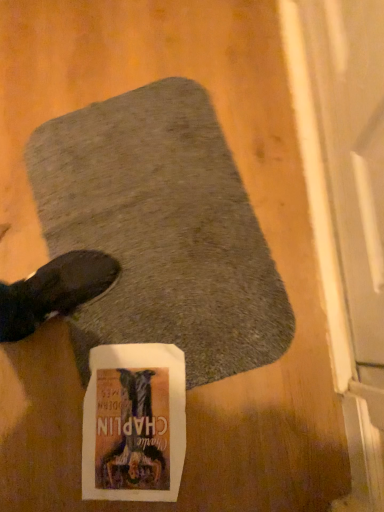
Question: Is white paper flyer at center bigger or smaller than gray soft rug at center?

Choices:
 (A) big
 (B) small

Answer: (B)

Question: From the image's perspective, is white paper flyer at center positioned above or below gray soft rug at center?

Choices:
 (A) below
 (B) above

Answer: (A)

Question: Is white paper flyer at center taller or shorter than gray soft rug at center?

Choices:
 (A) tall
 (B) short

Answer: (B)

Question: In terms of height, does gray soft rug at center look taller or shorter compared to white paper flyer at center?

Choices:
 (A) short
 (B) tall

Answer: (B)

Question: Considering their positions, is gray soft rug at center located in front of or behind white paper flyer at center?

Choices:
 (A) front
 (B) behind

Answer: (A)

Question: From a real-world perspective, is gray soft rug at center physically located above or below white paper flyer at center?

Choices:
 (A) above
 (B) below

Answer: (A)

Question: Is gray soft rug at center situated inside white paper flyer at center or outside?

Choices:
 (A) inside
 (B) outside

Answer: (B)